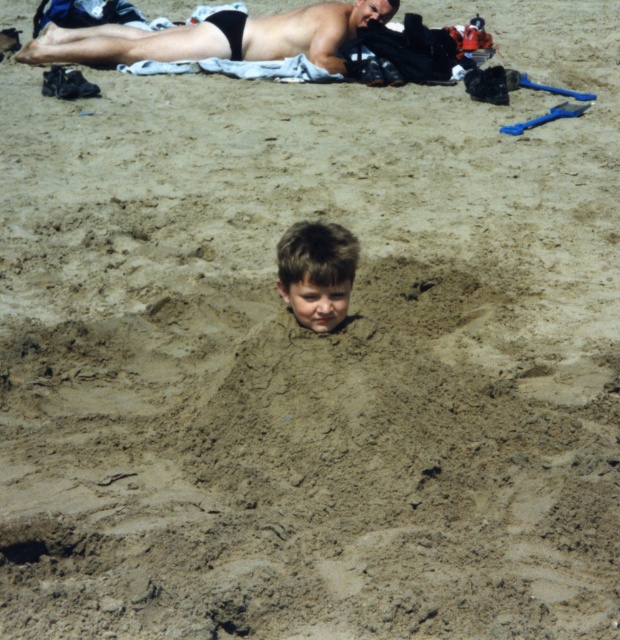
Is point (370, 12) positioned after point (355, 250)?

Yes, point (370, 12) is farther from viewer.

Can you confirm if smooth tan skin at upper center is positioned to the right of light brown hair at center?

In fact, smooth tan skin at upper center is to the left of light brown hair at center.

Who is more distant from viewer, (303, 19) or (339, 301)?

The point (303, 19) is behind.

At what (x,y) coordinates should I click in order to perform the action: click on smooth tan skin at upper center. Please return your answer as a coordinate pair (x, y). The image size is (620, 640). Looking at the image, I should click on (215, 36).